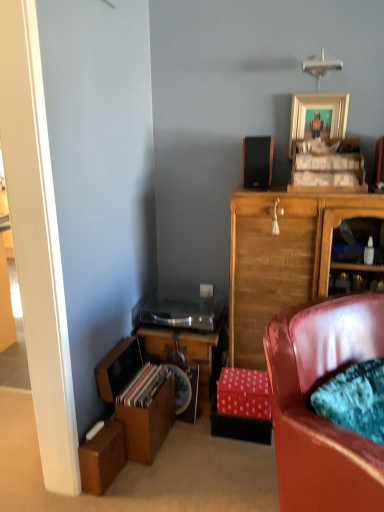
You are a GUI agent. You are given a task and a screenshot of the screen. Output one action in this format:
    pyautogui.click(x=<x>, y=<y>)
    Task: Click on the wooden desk at lower left
    The image size is (384, 512).
    Given the screenshot: What is the action you would take?
    coord(188,358)

This screenshot has width=384, height=512. Describe the element at coordinates (318, 109) in the screenshot. I see `gold metallic picture frame at upper center` at that location.

I want to click on pink polka dot cardboard box at lower center, which is the second cardboard box in bottom-to-top order, so click(243, 393).

Describe the element at coordinates (281, 258) in the screenshot. I see `wooden cabinet at upper right` at that location.

You are a GUI agent. You are given a task and a screenshot of the screen. Output one action in this format:
    pyautogui.click(x=<x>, y=<y>)
    Task: Click on the wooden desk at lower left
    Image resolution: width=384 pixels, height=512 pixels.
    Given the screenshot: What is the action you would take?
    pyautogui.click(x=188, y=358)

Is point (239, 378) closer to viewer compared to point (118, 456)?

No, it is behind (118, 456).

Between pink polka dot cardboard box at lower center, arranged as the 2th cardboard box when viewed from the left, and brown cardboard box at lower left, marked as the second cardboard box in a top-to-bottom arrangement, which one has more height?

brown cardboard box at lower left, marked as the second cardboard box in a top-to-bottom arrangement.

How distant is pink polka dot cardboard box at lower center, which is the 1th cardboard box from back to front, from brown cardboard box at lower left, acting as the second cardboard box starting from the right?

They are 24.08 inches apart.

From a real-world perspective, which is physically above, pink polka dot cardboard box at lower center, the first cardboard box viewed from the right, or brown cardboard box at lower left, placed as the first cardboard box when sorted from left to right?

From a 3D spatial view, pink polka dot cardboard box at lower center, the first cardboard box viewed from the right, is above.

Is wooden desk at lower left to the left or to the right of black matte speaker at upper center in the image?

Based on their positions, wooden desk at lower left is located to the left of black matte speaker at upper center.

Between point (192, 403) and point (252, 148), which one is positioned in front?

Positioned in front is point (252, 148).

Is wooden desk at lower left looking in the opposite direction of black matte speaker at upper center?

That's not correct — wooden desk at lower left is not looking away from black matte speaker at upper center.

Considering the sizes of objects wooden desk at lower left and black matte speaker at upper center in the image provided, who is bigger, wooden desk at lower left or black matte speaker at upper center?

Bigger between the two is wooden desk at lower left.

In the scene shown: Between pink polka dot cardboard box at lower center, arranged as the 2th cardboard box when viewed from the left, and wooden desk at lower left, which one has larger width?

wooden desk at lower left is wider.

From the image's perspective, which one is positioned higher, pink polka dot cardboard box at lower center, which is the 1th cardboard box from back to front, or wooden desk at lower left?

wooden desk at lower left appears higher in the image.

Is pink polka dot cardboard box at lower center, arranged as the 2th cardboard box when viewed from the left, positioned before wooden desk at lower left?

Yes, pink polka dot cardboard box at lower center, arranged as the 2th cardboard box when viewed from the left, is closer to the camera.

Can you see gold metallic picture frame at upper center touching black matte speaker at upper center?

They are not placed beside each other.

Based on their sizes in the image, would you say gold metallic picture frame at upper center is bigger or smaller than black matte speaker at upper center?

Clearly, gold metallic picture frame at upper center is smaller in size than black matte speaker at upper center.

Is gold metallic picture frame at upper center taller or shorter than black matte speaker at upper center?

Considering their sizes, gold metallic picture frame at upper center has more height than black matte speaker at upper center.

From the picture: Who is smaller, pink polka dot cardboard box at lower center, which is the 1th cardboard box from back to front, or velvet teal cushion at lower right?

With smaller size is pink polka dot cardboard box at lower center, which is the 1th cardboard box from back to front.

Looking at this image, considering the positions of objects pink polka dot cardboard box at lower center, the 1th cardboard box in the top-to-bottom sequence, and velvet teal cushion at lower right in the image provided, who is in front, pink polka dot cardboard box at lower center, the 1th cardboard box in the top-to-bottom sequence, or velvet teal cushion at lower right?

velvet teal cushion at lower right is in front.

From a real-world perspective, is pink polka dot cardboard box at lower center, arranged as the 2th cardboard box when viewed from the left, physically located above or below velvet teal cushion at lower right?

Clearly, from a real-world perspective, pink polka dot cardboard box at lower center, arranged as the 2th cardboard box when viewed from the left, is below velvet teal cushion at lower right.

From the picture: Considering the positions of objects black matte speaker at upper center and wooden cabinet at upper right in the image provided, who is in front, black matte speaker at upper center or wooden cabinet at upper right?

wooden cabinet at upper right is more forward.

In the image, is black matte speaker at upper center on the left side or the right side of wooden cabinet at upper right?

Based on their positions, black matte speaker at upper center is located to the left of wooden cabinet at upper right.

Is black matte speaker at upper center looking in the opposite direction of wooden cabinet at upper right?

That's not correct — black matte speaker at upper center is not looking away from wooden cabinet at upper right.

Locate an element on the screen. This screenshot has width=384, height=512. loudspeaker that is on the left side of wooden cabinet at upper right is located at coordinates (257, 162).

Which object is thinner, brown cardboard box at lower left, the second cardboard box viewed from the back, or velvet teal cushion at lower right?

Thinner between the two is brown cardboard box at lower left, the second cardboard box viewed from the back.

Would you say velvet teal cushion at lower right is part of brown cardboard box at lower left, marked as the second cardboard box in a top-to-bottom arrangement,'s contents?

No, velvet teal cushion at lower right is not inside brown cardboard box at lower left, marked as the second cardboard box in a top-to-bottom arrangement.

Measure the distance from brown cardboard box at lower left, the second cardboard box viewed from the back, to velvet teal cushion at lower right.

The distance of brown cardboard box at lower left, the second cardboard box viewed from the back, from velvet teal cushion at lower right is 34.77 inches.

Are brown cardboard box at lower left, marked as the second cardboard box in a top-to-bottom arrangement, and velvet teal cushion at lower right far apart?

Actually, brown cardboard box at lower left, marked as the second cardboard box in a top-to-bottom arrangement, and velvet teal cushion at lower right are a little close together.

You are a GUI agent. You are given a task and a screenshot of the screen. Output one action in this format:
    pyautogui.click(x=<x>, y=<y>)
    Task: Click on the cardboard box on the left of the pink polka dot cardboard box at lower center, placed as the second cardboard box when sorted from front to back
    This screenshot has height=512, width=384.
    Given the screenshot: What is the action you would take?
    pyautogui.click(x=102, y=457)

At what (x,y) coordinates should I click in order to perform the action: click on loudspeaker on the right side of wooden desk at lower left. Please return your answer as a coordinate pair (x, y). Looking at the image, I should click on (257, 162).

Considering their positions, is velvet teal cushion at lower right positioned closer to black matte speaker at upper center than gold metallic picture frame at upper center?

gold metallic picture frame at upper center is positioned closer to the anchor black matte speaker at upper center.

Based on their spatial positions, is wooden cabinet at upper right or pink polka dot cardboard box at lower center, which is the 1th cardboard box from back to front, closer to velvet teal cushion at lower right?

wooden cabinet at upper right lies closer to velvet teal cushion at lower right than the other object.

Estimate the real-world distances between objects in this image. Which object is closer to brown cardboard box at lower left, marked as the second cardboard box in a top-to-bottom arrangement, wooden cabinet at upper right or wooden desk at lower left?

Based on the image, wooden desk at lower left appears to be nearer to brown cardboard box at lower left, marked as the second cardboard box in a top-to-bottom arrangement.

Estimate the real-world distances between objects in this image. Which object is closer to brown cardboard box at lower left, which is the first cardboard box from bottom to top, black matte speaker at upper center or gold metallic picture frame at upper center?

Based on the image, black matte speaker at upper center appears to be nearer to brown cardboard box at lower left, which is the first cardboard box from bottom to top.

Looking at the image, which one is located closer to black matte speaker at upper center, wooden desk at lower left or brown cardboard box at lower left, which is the first cardboard box from bottom to top?

wooden desk at lower left is positioned closer to the anchor black matte speaker at upper center.

Estimate the real-world distances between objects in this image. Which object is further from pink polka dot cardboard box at lower center, the 1th cardboard box in the top-to-bottom sequence, brown cardboard box at lower left, acting as the second cardboard box starting from the right, or velvet teal cushion at lower right?

Among the two, brown cardboard box at lower left, acting as the second cardboard box starting from the right, is located further to pink polka dot cardboard box at lower center, the 1th cardboard box in the top-to-bottom sequence.

Estimate the real-world distances between objects in this image. Which object is further from wooden cabinet at upper right, wooden desk at lower left or velvet teal cushion at lower right?

velvet teal cushion at lower right.

Estimate the real-world distances between objects in this image. Which object is closer to wooden cabinet at upper right, pink polka dot cardboard box at lower center, the first cardboard box viewed from the right, or gold metallic picture frame at upper center?

pink polka dot cardboard box at lower center, the first cardboard box viewed from the right, is closer to wooden cabinet at upper right.

At what (x,y) coordinates should I click in order to perform the action: click on chair between black matte speaker at upper center and pink polka dot cardboard box at lower center, which is the second cardboard box in bottom-to-top order, in the up-down direction. Please return your answer as a coordinate pair (x, y). The height and width of the screenshot is (512, 384). Looking at the image, I should click on (314, 412).

This screenshot has width=384, height=512. What are the coordinates of `cardboard box between brown cardboard box at lower left, marked as the second cardboard box in a top-to-bottom arrangement, and wooden cabinet at upper right from left to right` in the screenshot? It's located at (243, 393).

Locate an element on the screen. This screenshot has height=512, width=384. cabinetry between gold metallic picture frame at upper center and velvet teal cushion at lower right from top to bottom is located at coordinates (281, 258).

Where is `desk between brown cardboard box at lower left, the second cardboard box viewed from the back, and wooden cabinet at upper right from left to right`? Image resolution: width=384 pixels, height=512 pixels. desk between brown cardboard box at lower left, the second cardboard box viewed from the back, and wooden cabinet at upper right from left to right is located at coordinates (188, 358).